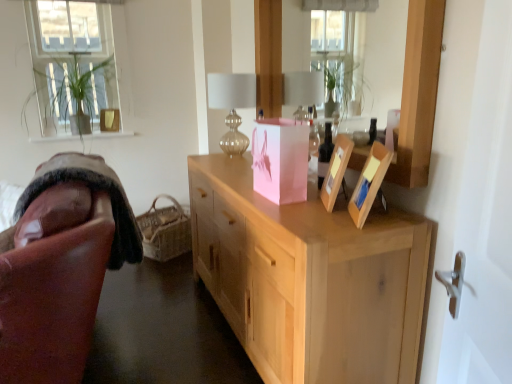
Question: Is the depth of leather at left less than that of clear glass window at upper left?

Choices:
 (A) no
 (B) yes

Answer: (B)

Question: Is leather at left wider than clear glass window at upper left?

Choices:
 (A) no
 (B) yes

Answer: (B)

Question: Can you confirm if leather at left is thinner than clear glass window at upper left?

Choices:
 (A) yes
 (B) no

Answer: (B)

Question: Are leather at left and clear glass window at upper left beside each other?

Choices:
 (A) yes
 (B) no

Answer: (B)

Question: Can you confirm if leather at left is bigger than clear glass window at upper left?

Choices:
 (A) yes
 (B) no

Answer: (A)

Question: Is leather at left positioned behind clear glass window at upper left?

Choices:
 (A) no
 (B) yes

Answer: (A)

Question: Can you see woven natural basket at lower left touching pink paper bag at center?

Choices:
 (A) yes
 (B) no

Answer: (B)

Question: Is the depth of woven natural basket at lower left greater than that of pink paper bag at center?

Choices:
 (A) no
 (B) yes

Answer: (B)

Question: Is woven natural basket at lower left taller than pink paper bag at center?

Choices:
 (A) yes
 (B) no

Answer: (A)

Question: Would you say pink paper bag at center is part of woven natural basket at lower left's contents?

Choices:
 (A) no
 (B) yes

Answer: (A)

Question: From the image's perspective, would you say woven natural basket at lower left is shown under pink paper bag at center?

Choices:
 (A) yes
 (B) no

Answer: (A)

Question: Is woven natural basket at lower left located outside pink paper bag at center?

Choices:
 (A) yes
 (B) no

Answer: (A)

Question: Is translucent glass table lamp at center facing away from leather at left?

Choices:
 (A) yes
 (B) no

Answer: (B)